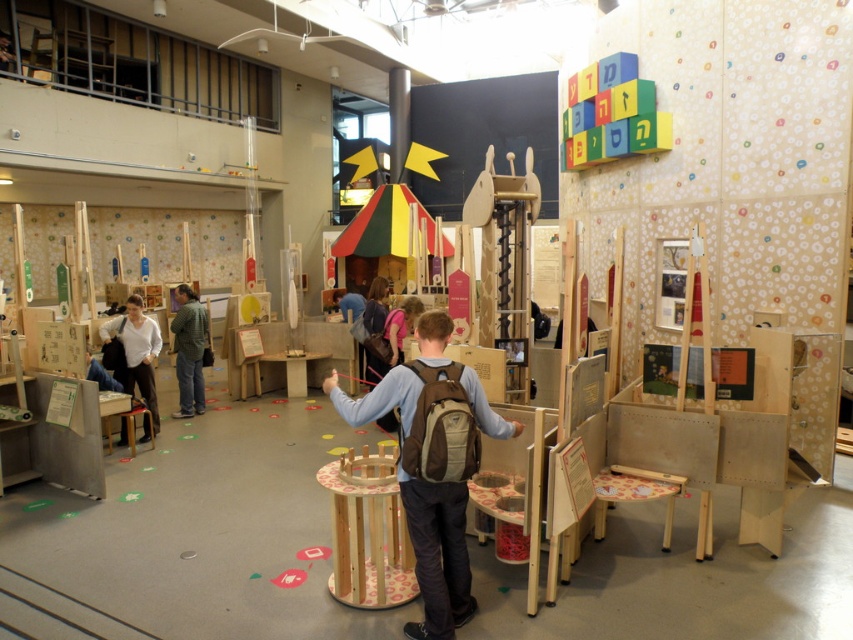
Is brown fabric backpack at center closer to camera compared to green matte jacket at center?

Yes.

Between point (424, 564) and point (202, 330), which one is positioned in front?

Point (424, 564) is more forward.

This screenshot has height=640, width=853. I want to click on brown fabric backpack at center, so click(x=437, y=554).

Between multicolored wooden blocks at upper right and green matte jacket at center, which one has more height?

Standing taller between the two is green matte jacket at center.

Is multicolored wooden blocks at upper right thinner than green matte jacket at center?

No, multicolored wooden blocks at upper right is not thinner than green matte jacket at center.

Where is `multicolored wooden blocks at upper right`? The height and width of the screenshot is (640, 853). multicolored wooden blocks at upper right is located at coordinates (611, 113).

What are the coordinates of `multicolored wooden blocks at upper right` in the screenshot? It's located at (611, 113).

Which of these two, brown fabric backpack at center or multicolored wooden blocks at upper right, stands taller?

With more height is brown fabric backpack at center.

Does point (459, 620) come closer to viewer compared to point (575, 150)?

Yes, point (459, 620) is in front of point (575, 150).

Does point (376, 397) come behind point (602, 96)?

That is False.

I want to click on brown fabric backpack at center, so click(437, 554).